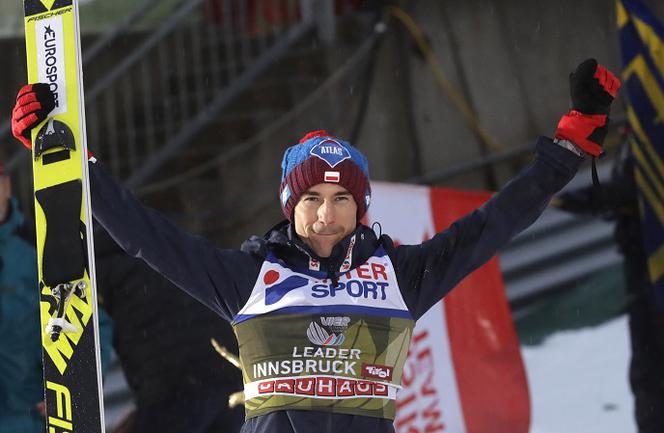
Image resolution: width=664 pixels, height=433 pixels. I want to click on stairs, so click(212, 144).